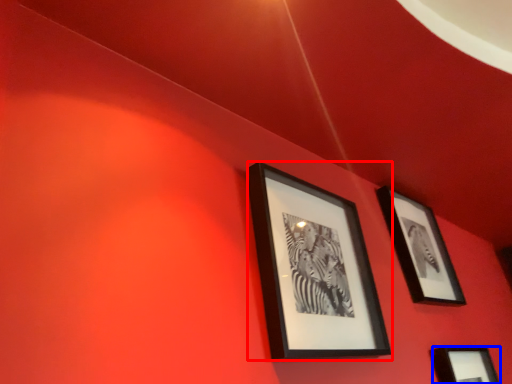
Question: Which of the following is the farthest to the observer, picture frame (highlighted by a red box) or picture frame (highlighted by a blue box)?

Choices:
 (A) picture frame
 (B) picture frame

Answer: (B)